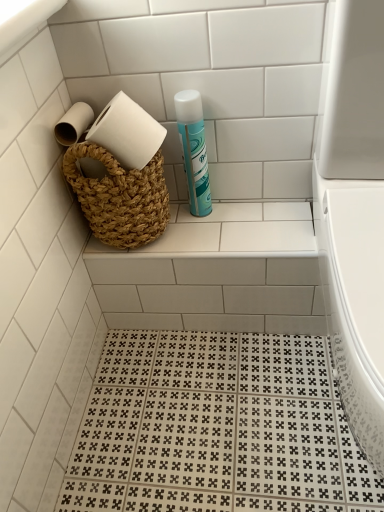
Find the location of a particular element. vacant space that is to the left of teal matte cleaning product at upper center is located at coordinates (162, 230).